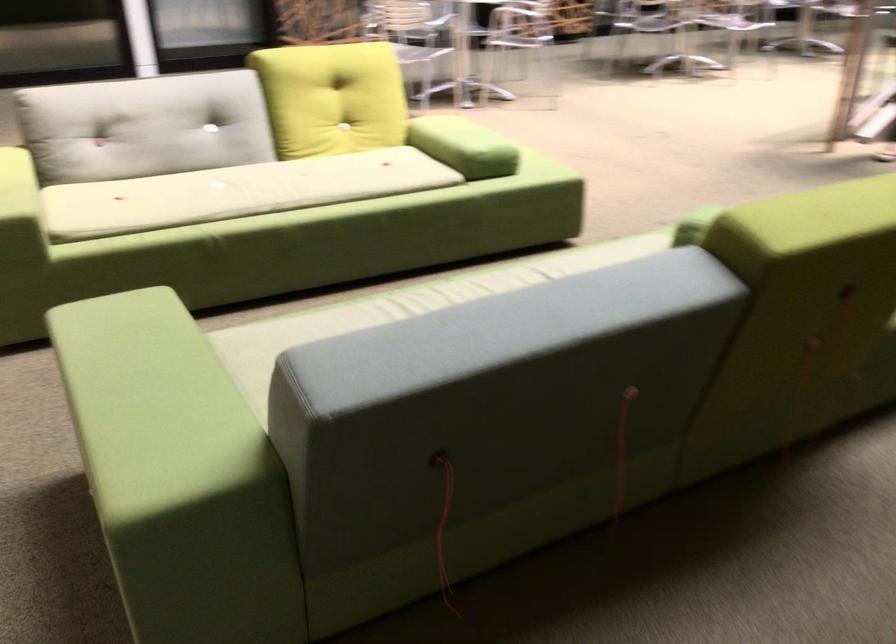
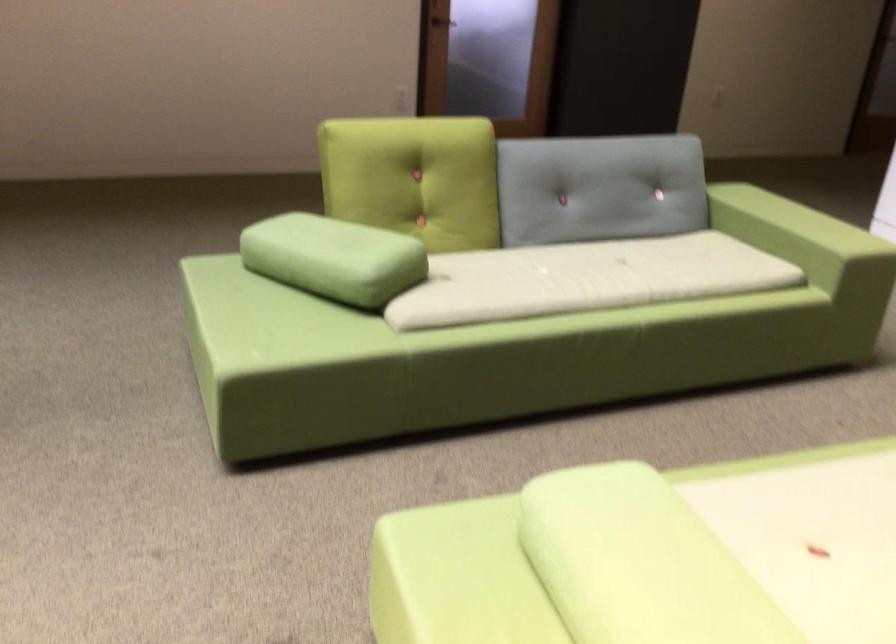
Find the pixel in the second image that matches the point at 565,251 in the first image.

(504, 334)